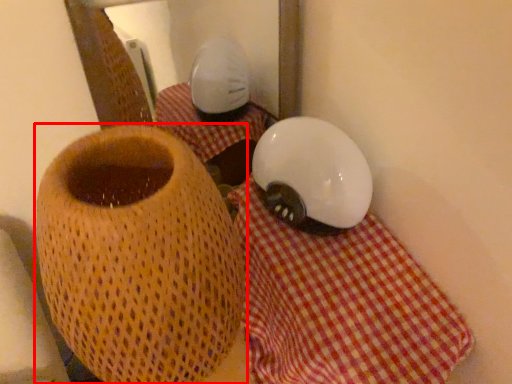
Question: Where is vase (annotated by the red box) located in relation to tablecloth in the image?

Choices:
 (A) left
 (B) right

Answer: (A)